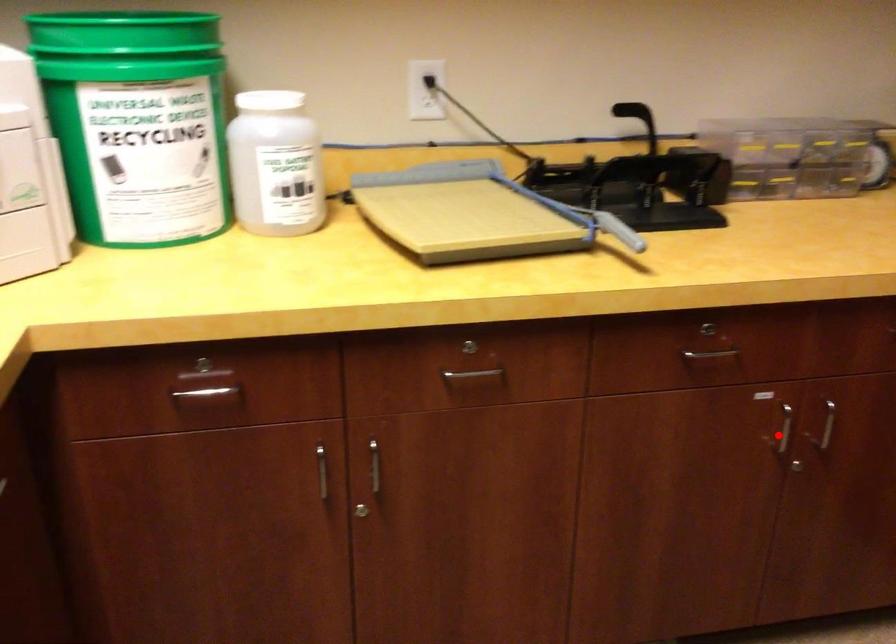
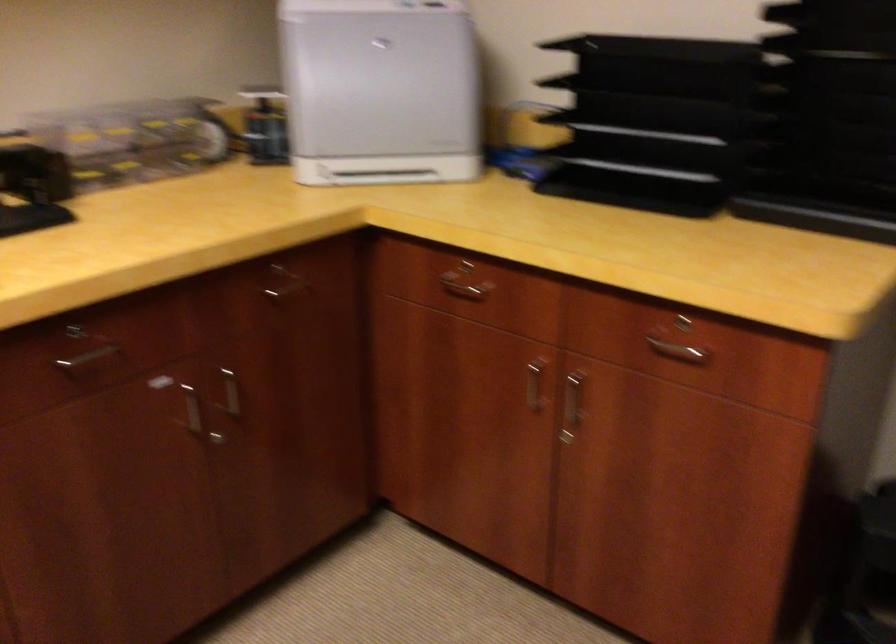
In the second image, find the point that corresponds to the highlighted location in the first image.

(192, 408)